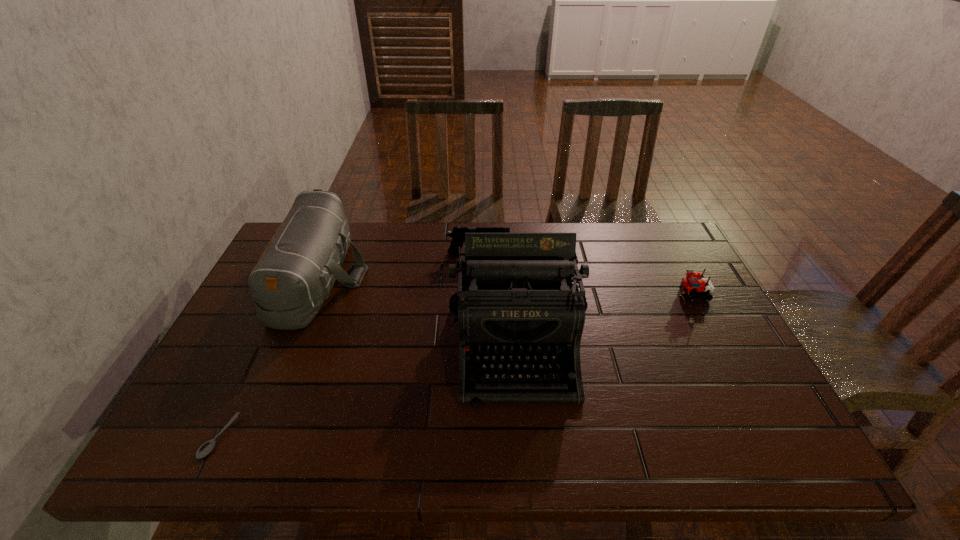
The image size is (960, 540). Find the location of `object that is at the far left corner`. object that is at the far left corner is located at coordinates (294, 275).

This screenshot has height=540, width=960. I want to click on object at the near left corner, so click(207, 447).

At what (x,y) coordinates should I click in order to perform the action: click on vacant space at the far edge. Please return your answer as a coordinate pair (x, y). The image size is (960, 540). Looking at the image, I should click on (625, 237).

In order to click on free space at the near edge of the desktop in this screenshot , I will do `click(408, 450)`.

Locate an element on the screen. Image resolution: width=960 pixels, height=540 pixels. free space at the right edge is located at coordinates (697, 347).

Identify the location of free location at the near right corner of the desktop. (731, 436).

The image size is (960, 540). I want to click on empty location between the third tallest object and the second tallest object, so click(398, 265).

Where is `unoccupied position between the soupspoon and the typewriter`? The height and width of the screenshot is (540, 960). unoccupied position between the soupspoon and the typewriter is located at coordinates (368, 389).

I want to click on free spot between the third shortest object and the soupspoon, so click(348, 345).

Where is `free space that is in between the gun and the second tallest object`? free space that is in between the gun and the second tallest object is located at coordinates (398, 265).